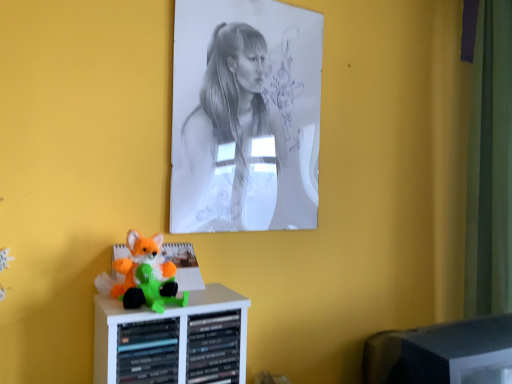
Question: Considering the positions of black plastic monitor at lower right and fluffy plush toy at lower left in the image, is black plastic monitor at lower right taller or shorter than fluffy plush toy at lower left?

Choices:
 (A) tall
 (B) short

Answer: (A)

Question: Is black plastic monitor at lower right in front of or behind fluffy plush toy at lower left in the image?

Choices:
 (A) behind
 (B) front

Answer: (A)

Question: Which is farther from the graphite paper portrait at upper center?

Choices:
 (A) fluffy plush toy at lower left
 (B) black plastic monitor at lower right

Answer: (B)

Question: Estimate the real-world distances between objects in this image. Which object is closer to the fluffy plush toy at lower left?

Choices:
 (A) graphite paper portrait at upper center
 (B) black plastic monitor at lower right

Answer: (A)